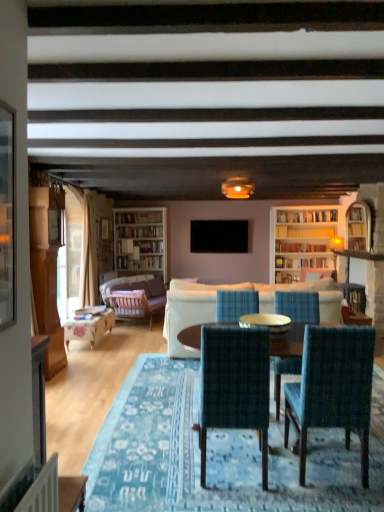
You are a GUI agent. You are given a task and a screenshot of the screen. Output one action in this format:
    pyautogui.click(x=<x>, y=<y>)
    Task: Click on the unoccupied region to the right of wooden cabinet at left
    This screenshot has height=512, width=384.
    Given the screenshot: What is the action you would take?
    pyautogui.click(x=81, y=372)